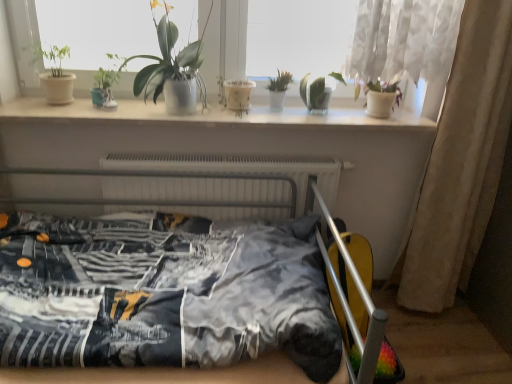
The image size is (512, 384). Find the location of `vacant area situated below translucent glass vase at upper center, which appears as the 1th houseplant when viewed from the right (from a real-world perspective)`. vacant area situated below translucent glass vase at upper center, which appears as the 1th houseplant when viewed from the right (from a real-world perspective) is located at coordinates (313, 110).